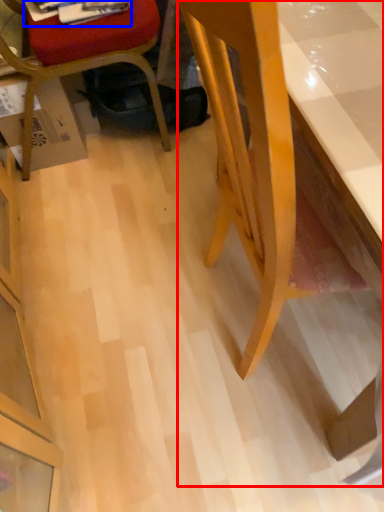
Question: Among these objects, which one is farthest to the camera, desk (highlighted by a red box) or magazine (highlighted by a blue box)?

Choices:
 (A) desk
 (B) magazine

Answer: (B)